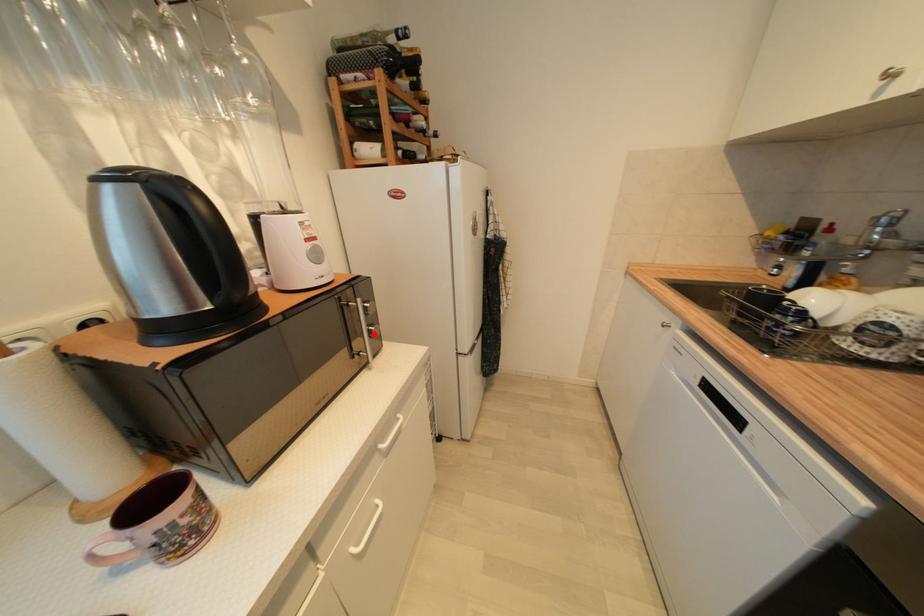
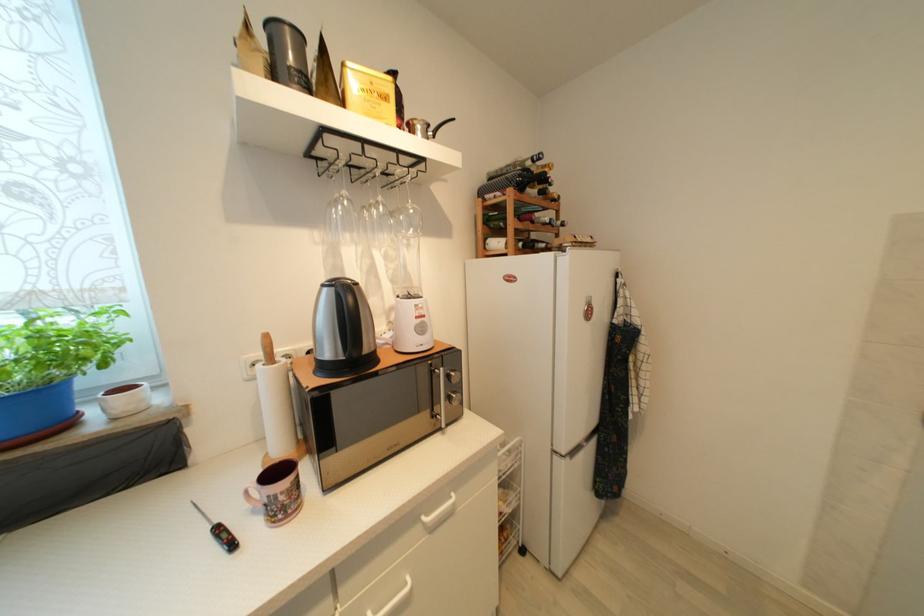
Question: I am providing you with two images of the same scene from different viewpoints. A red point is marked on the first image. At the location where the point appears in image 1, is it still visible in image 2?

Choices:
 (A) Yes
 (B) No

Answer: (A)